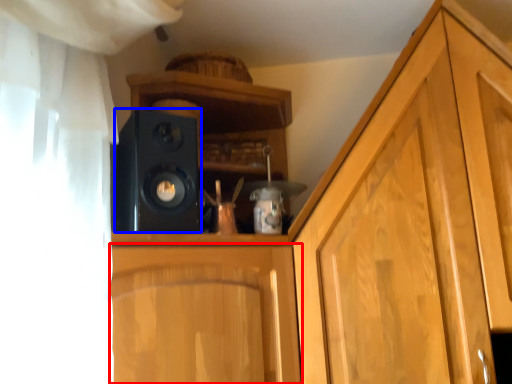
Question: Which object appears closest to the camera in this image, cabinetry (highlighted by a red box) or speaker (highlighted by a blue box)?

Choices:
 (A) cabinetry
 (B) speaker

Answer: (A)